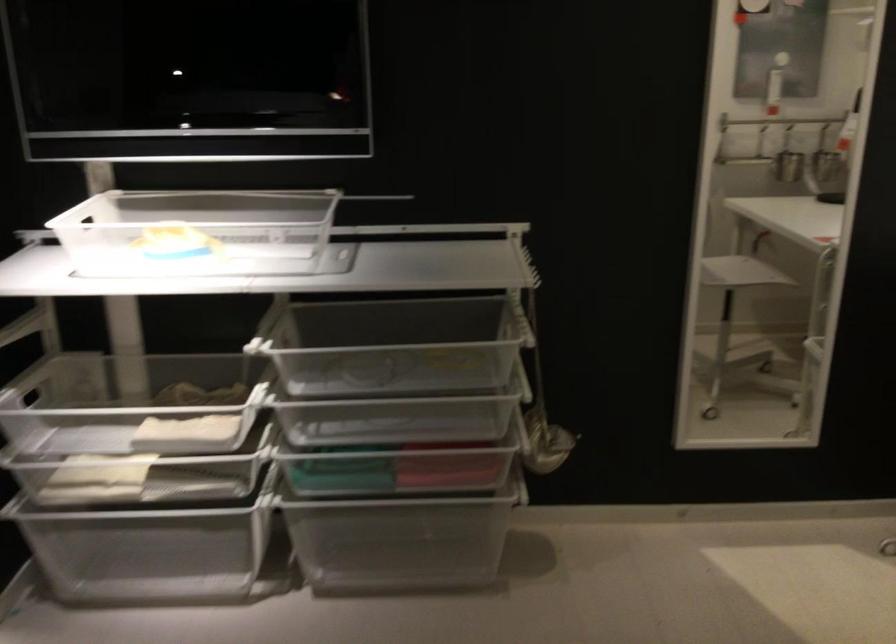
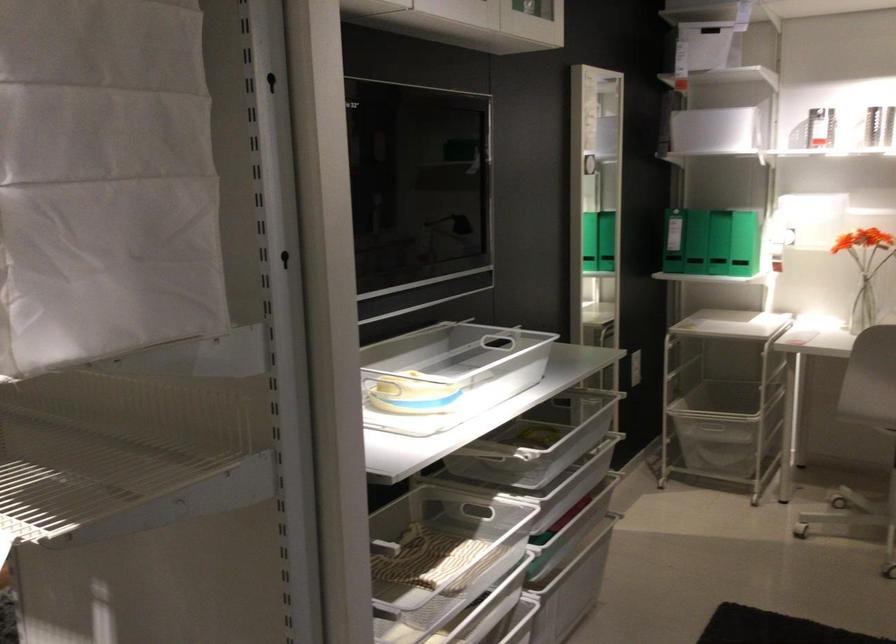
Question: I am providing you with two images of the same scene from different viewpoints. After the viewpoint changes to image2, which objects are now occluded?

Choices:
 (A) radiator thermostat
 (B) wire mesh basket
 (C) plastic drawer handle
 (D) basket handle

Answer: (D)